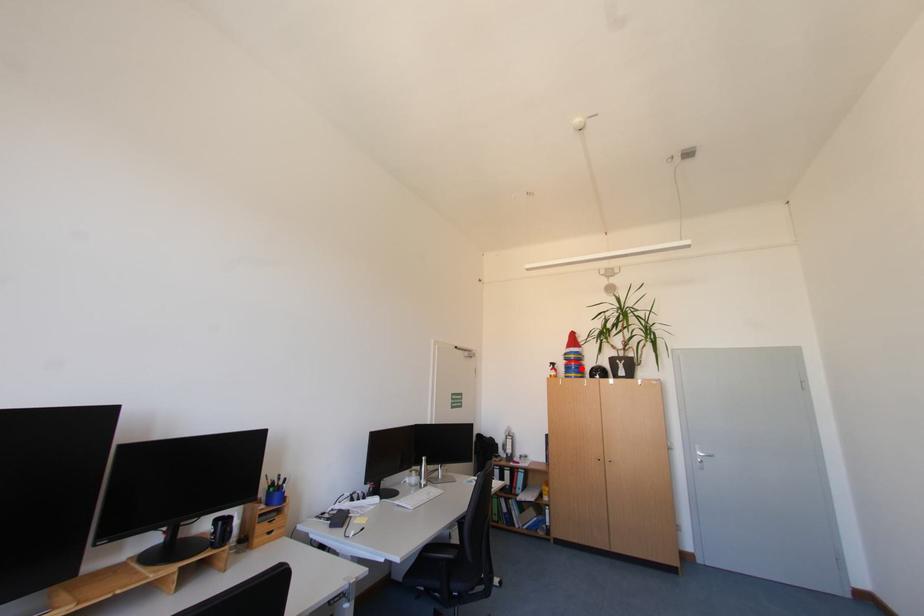
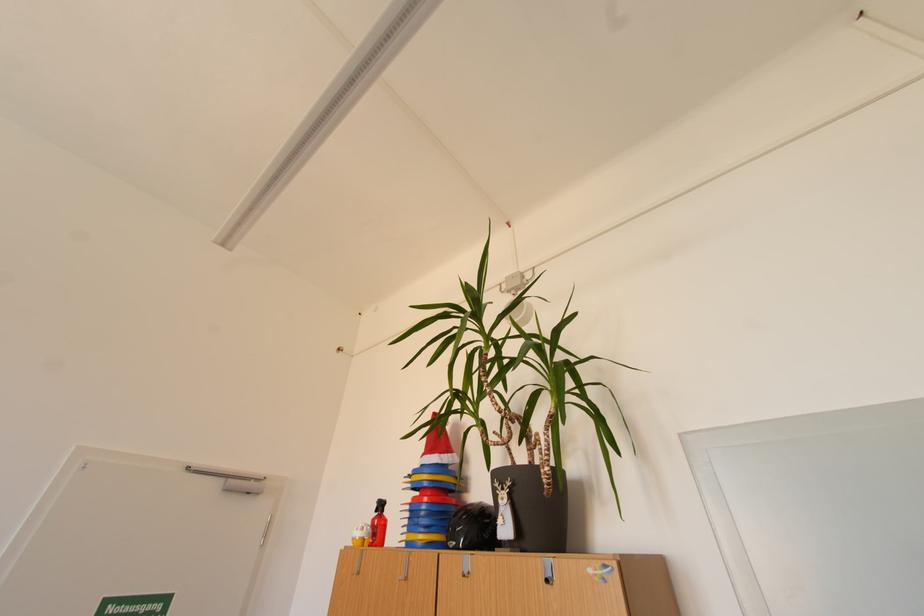
In the second image, find the point that corresponds to the highlighted location in the first image.

(431, 514)